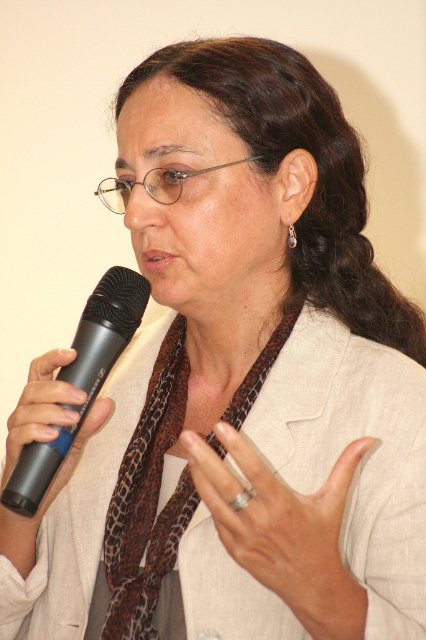
Is silver metallic ring at center to the right of black rubber microphone at left from the viewer's perspective?

Indeed, silver metallic ring at center is positioned on the right side of black rubber microphone at left.

Between point (316, 522) and point (103, 355), which one is positioned in front?

Point (316, 522) is more forward.

Find the location of a particular element. This screenshot has height=640, width=426. silver metallic ring at center is located at coordinates (284, 531).

Can you confirm if silver metallic ring at center is taller than brown leopard print scarf at center?

No, silver metallic ring at center is not taller than brown leopard print scarf at center.

Is point (310, 584) positioned in front of point (132, 499)?

Yes, it is.

What do you see at coordinates (284, 531) in the screenshot? The image size is (426, 640). I see `silver metallic ring at center` at bounding box center [284, 531].

Image resolution: width=426 pixels, height=640 pixels. I want to click on silver metallic ring at center, so [x=284, y=531].

Identify the location of silver metallic ring at center. (284, 531).

Image resolution: width=426 pixels, height=640 pixels. Describe the element at coordinates (284, 531) in the screenshot. I see `silver metallic ring at center` at that location.

Locate an element on the screen. The height and width of the screenshot is (640, 426). silver metallic ring at center is located at coordinates (284, 531).